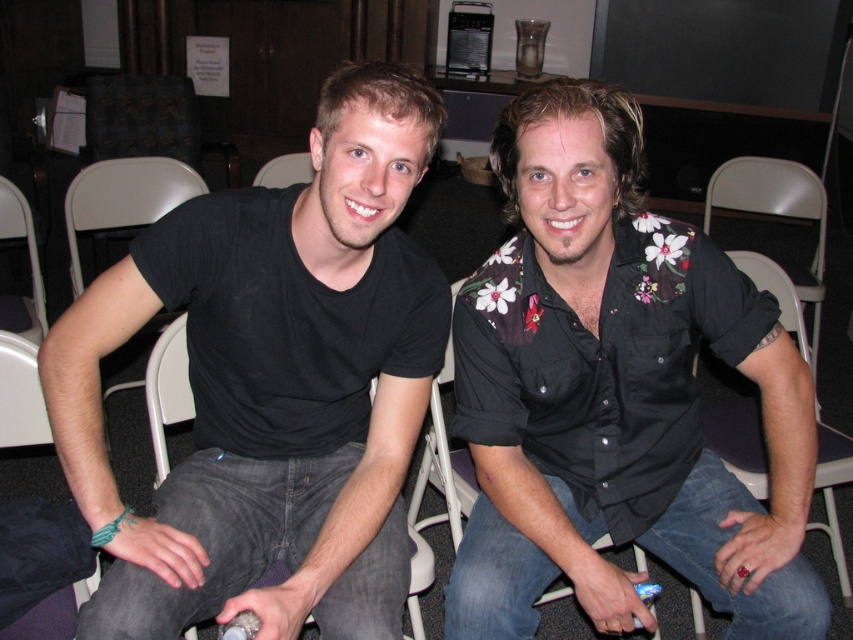
Who is higher up, floral-patterned shirt at center or white plastic chair at lower right?

floral-patterned shirt at center is above.

Where is `floral-patterned shirt at center`? The image size is (853, 640). floral-patterned shirt at center is located at coordinates (616, 394).

Is gray fabric chair at left smaller than white plastic chair at left?

Yes.

Can you confirm if gray fabric chair at left is positioned below white plastic chair at left?

Yes, gray fabric chair at left is below white plastic chair at left.

Who is more forward, (x=178, y=376) or (x=9, y=320)?

Point (x=178, y=376) is more forward.

The height and width of the screenshot is (640, 853). Find the location of `gray fabric chair at left`. gray fabric chair at left is located at coordinates (167, 388).

Does white plastic chair at lower right appear under white plastic chair at left?

Indeed, white plastic chair at lower right is positioned under white plastic chair at left.

Between white plastic chair at lower right and white plastic chair at left, which one is positioned lower?

white plastic chair at lower right is below.

Identify the location of white plastic chair at lower right. The height and width of the screenshot is (640, 853). (738, 440).